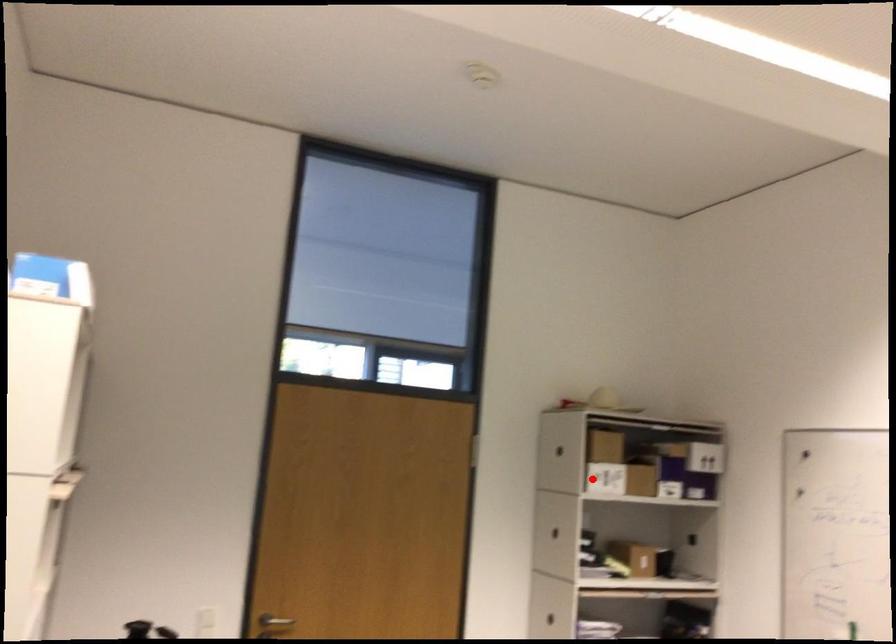
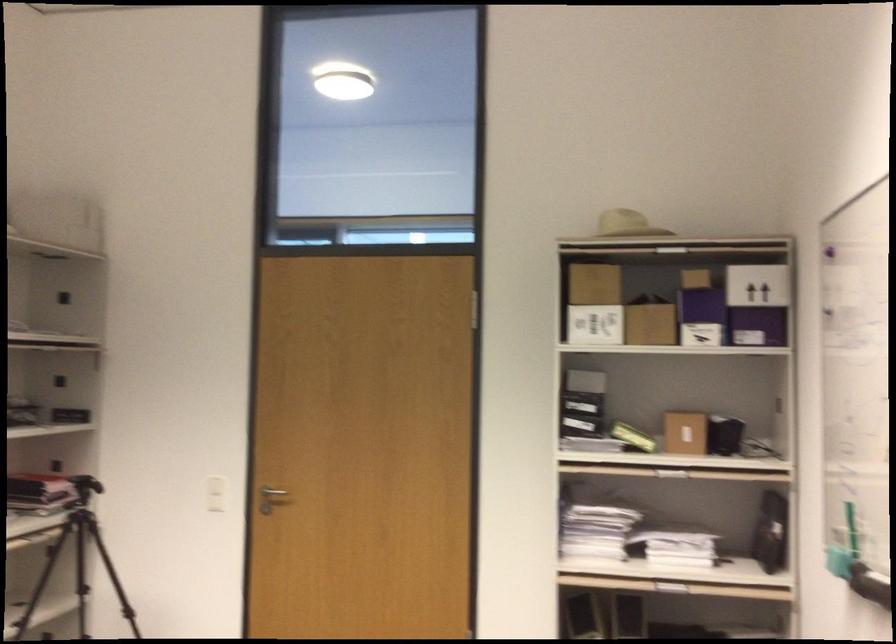
In the second image, find the point that corresponds to the highlighted location in the first image.

(595, 325)